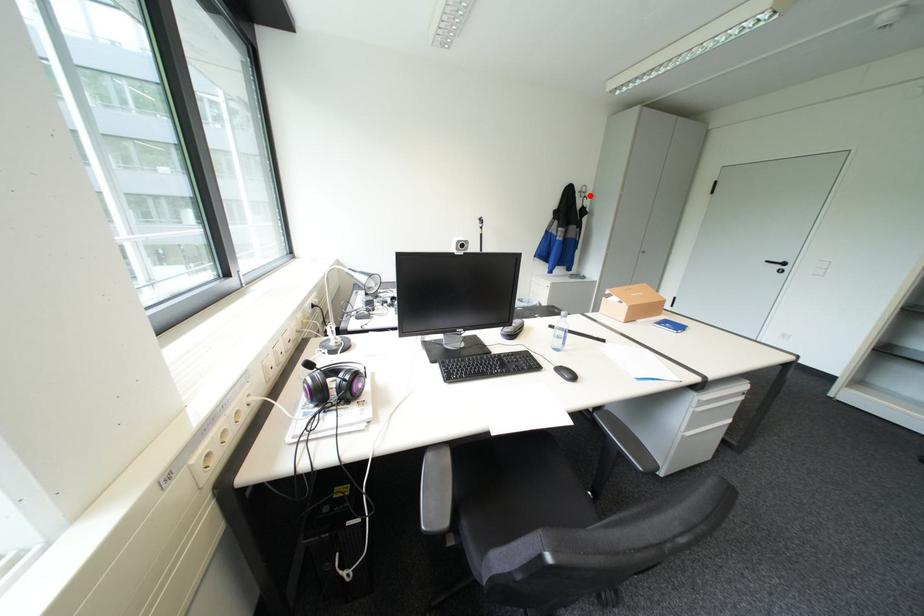
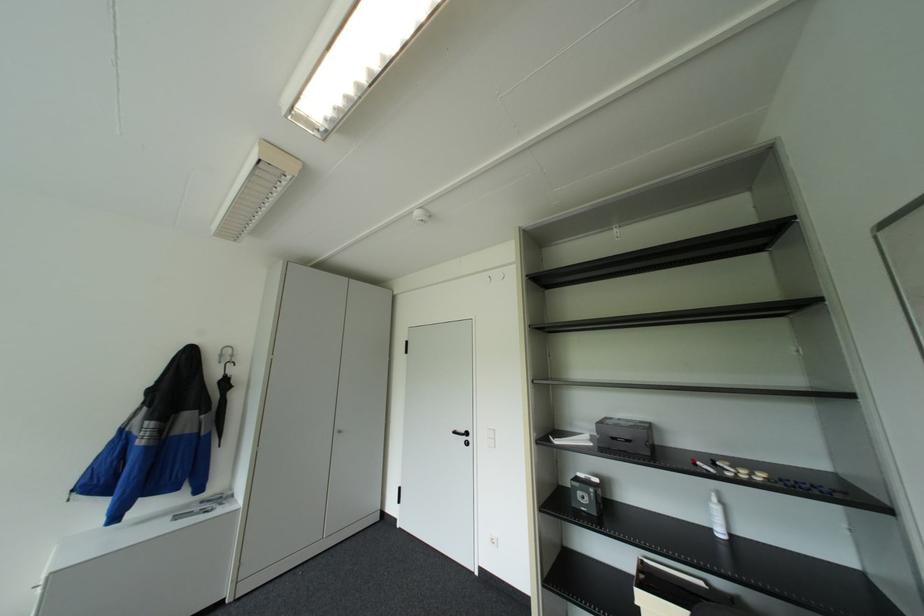
Find the pixel in the second image that matches the highlighted location in the first image.

(227, 361)